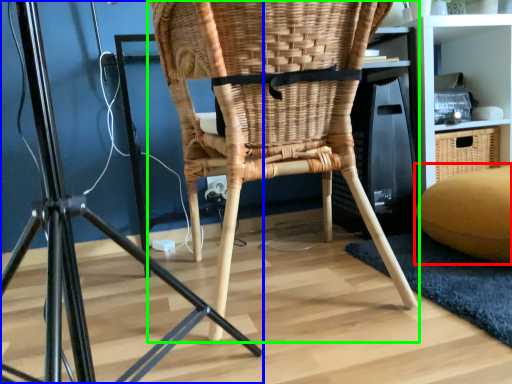
Question: Which object is the closest to the bean bag chair (highlighted by a red box)? Choose among these: furniture (highlighted by a blue box) or chair (highlighted by a green box).

Choices:
 (A) furniture
 (B) chair

Answer: (B)